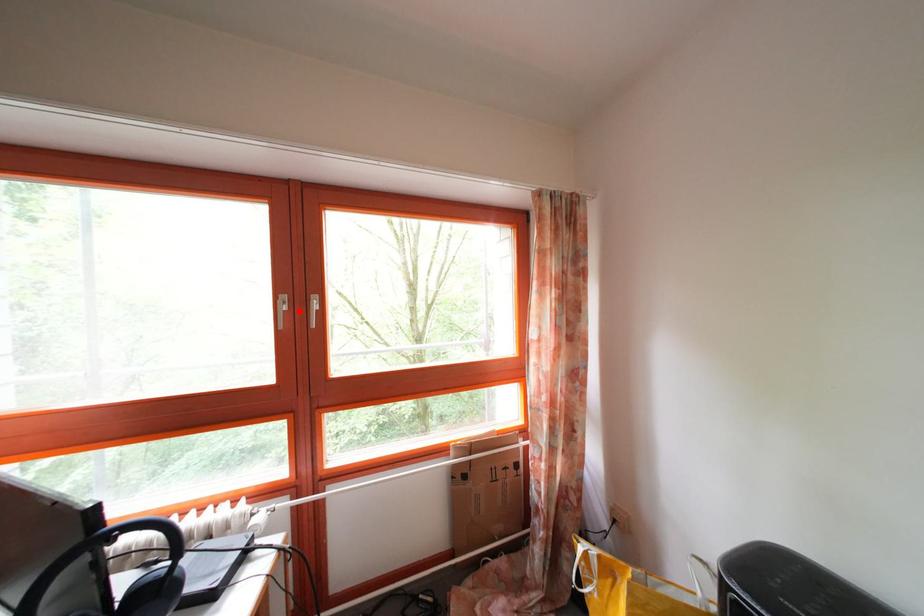
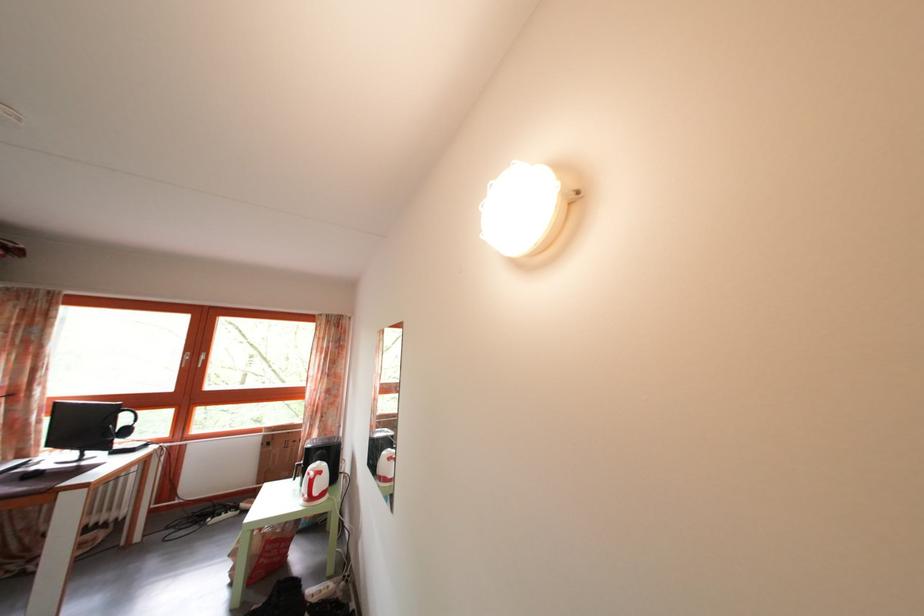
The point at the highlighted location is marked in the first image. Where is the corresponding point in the second image?

(199, 363)